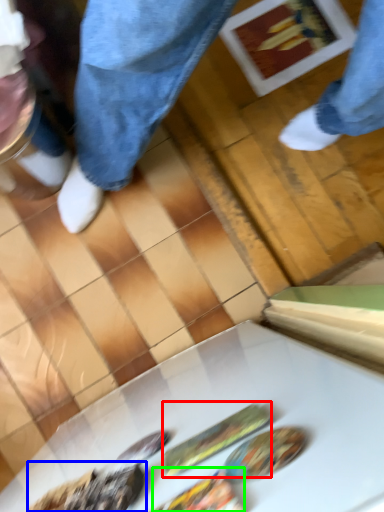
Question: Which object is positioned closest to food (highlighted by a red box)? Select from food (highlighted by a blue box) and food (highlighted by a green box).

Choices:
 (A) food
 (B) food

Answer: (B)